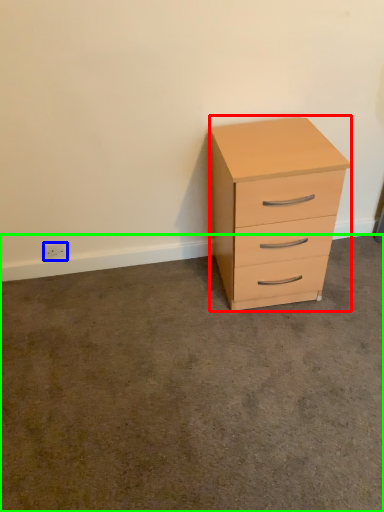
Question: Estimate the real-world distances between objects in this image. Which object is closer to chest of drawers (highlighted by a red box), electric outlet (highlighted by a blue box) or concrete (highlighted by a green box)?

Choices:
 (A) electric outlet
 (B) concrete

Answer: (B)